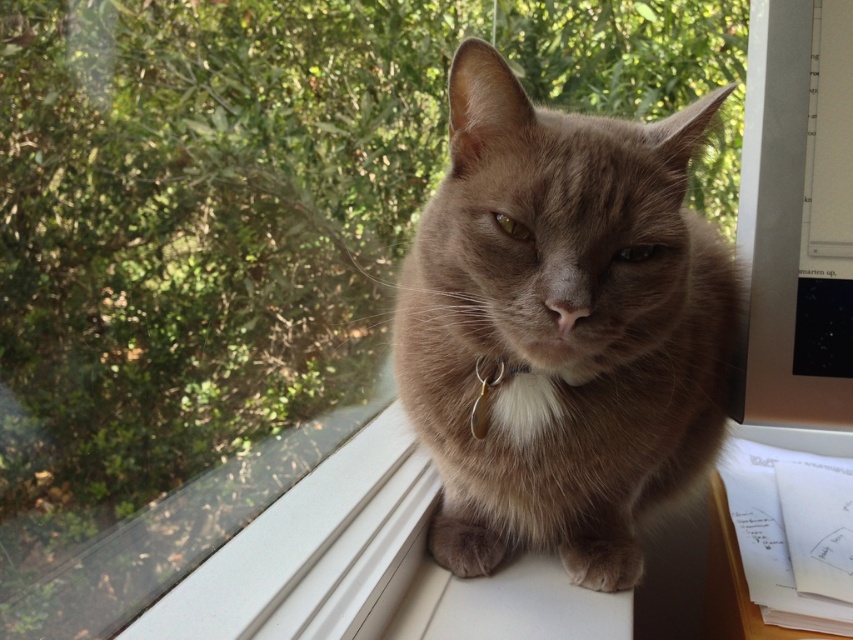
Question: Can you confirm if fuzzy brown cat at center is positioned above silver metallic collar at center?

Choices:
 (A) no
 (B) yes

Answer: (B)

Question: Which point is farther to the camera?

Choices:
 (A) fuzzy brown cat at center
 (B) silver metallic collar at center

Answer: (B)

Question: Can you confirm if fuzzy brown cat at center is positioned to the right of silver metallic collar at center?

Choices:
 (A) yes
 (B) no

Answer: (A)

Question: Does fuzzy brown cat at center have a greater width compared to silver metallic collar at center?

Choices:
 (A) yes
 (B) no

Answer: (A)

Question: Which point appears closest to the camera in this image?

Choices:
 (A) (590, 196)
 (B) (480, 432)

Answer: (A)